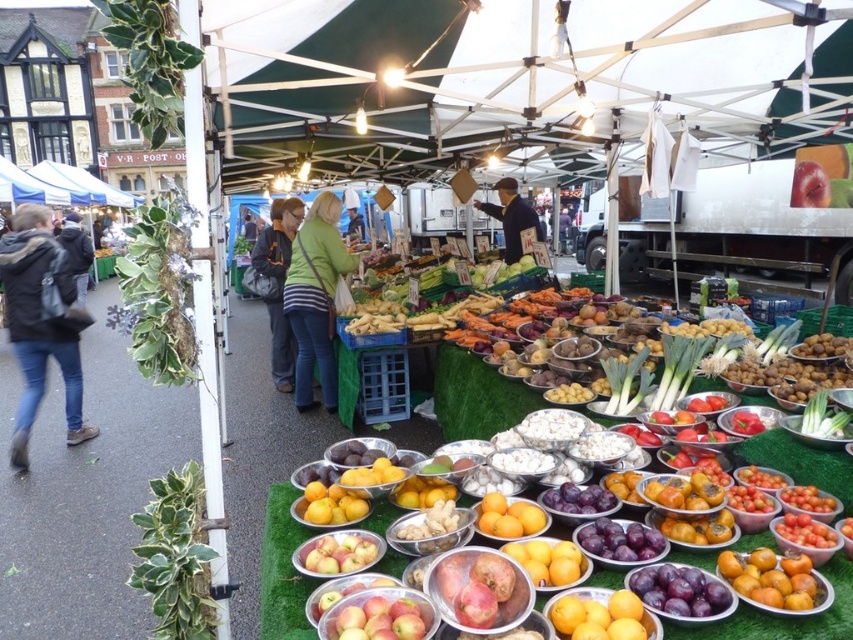
Is blue fabric canopy at upper left taller than dark gray jacket at left?

Yes, blue fabric canopy at upper left is taller than dark gray jacket at left.

Based on the photo, who is lower down, blue fabric canopy at upper left or dark gray jacket at left?

dark gray jacket at left

Does point (3, 170) lie behind point (88, 250)?

Yes, point (3, 170) is behind point (88, 250).

Locate an element on the screen. The height and width of the screenshot is (640, 853). blue fabric canopy at upper left is located at coordinates (62, 186).

Which of these two, black leather jacket at left or yellow matte oranges at center, stands taller?

Standing taller between the two is black leather jacket at left.

Does point (32, 356) come closer to viewer compared to point (627, 634)?

No, (32, 356) is behind (627, 634).

Who is more forward, [41,362] or [631,628]?

Point [631,628] is in front.

This screenshot has height=640, width=853. In order to click on black leather jacket at left in this screenshot , I will do `click(39, 323)`.

Identify the location of blue fabric canopy at upper left. Image resolution: width=853 pixels, height=640 pixels. (62, 186).

Does blue fabric canopy at upper left appear on the right side of dark blue jacket at center?

In fact, blue fabric canopy at upper left is to the left of dark blue jacket at center.

Identify the location of blue fabric canopy at upper left. Image resolution: width=853 pixels, height=640 pixels. (62, 186).